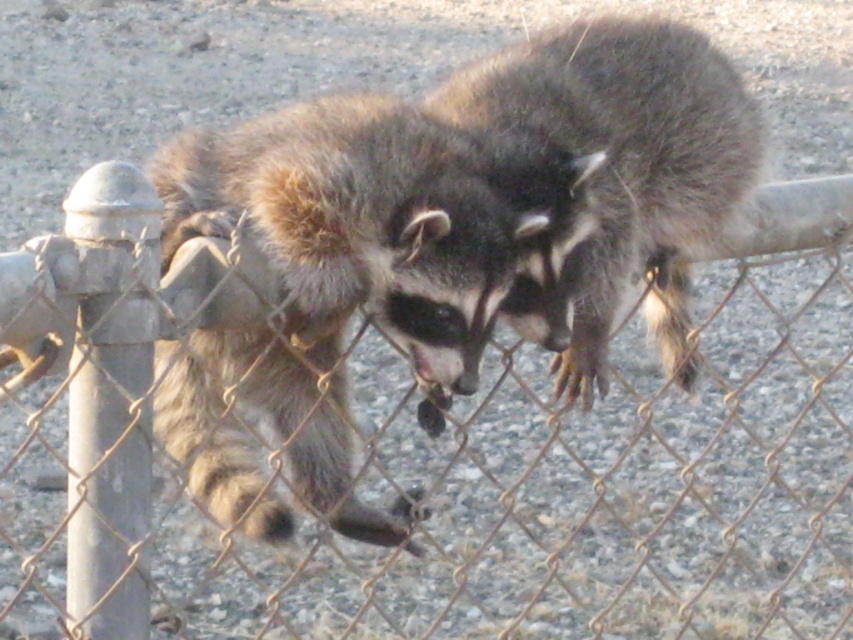
Consider the image. Does fuzzy brown raccoon at center appear on the right side of dark brown fur raccoon at center?

In fact, fuzzy brown raccoon at center is to the left of dark brown fur raccoon at center.

What do you see at coordinates (328, 292) in the screenshot? I see `fuzzy brown raccoon at center` at bounding box center [328, 292].

Is point (242, 512) more distant than point (465, 74)?

No.

Find the location of a particular element. The width and height of the screenshot is (853, 640). fuzzy brown raccoon at center is located at coordinates (328, 292).